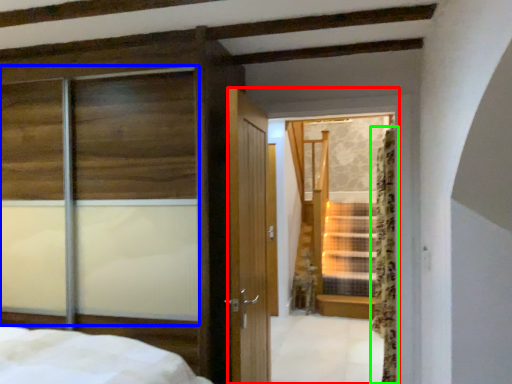
Question: Based on their relative distances, which object is nearer to glass door (highlighted by a red box)? Choose from window (highlighted by a blue box) and curtain (highlighted by a green box).

Choices:
 (A) window
 (B) curtain

Answer: (A)